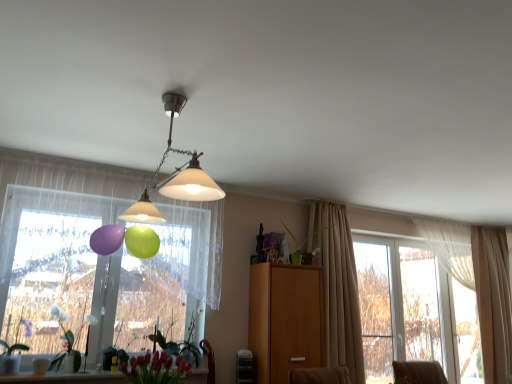
The image size is (512, 384). Describe the element at coordinates (66, 378) in the screenshot. I see `translucent glass vase at lower center, which ranks as the 2th window in top-to-bottom order` at that location.

This screenshot has height=384, width=512. What do you see at coordinates (493, 301) in the screenshot?
I see `beige fabric curtain at right, which appears as the 1th curtain when viewed from the right` at bounding box center [493, 301].

Measure the distance between beige fabric curtain at right, which is the second curtain in right-to-left order, and camera.

The depth of beige fabric curtain at right, which is the second curtain in right-to-left order, is 4.07 meters.

This screenshot has width=512, height=384. In order to click on transparent glass door at right, which is counted as the 1th window frame, starting from the right in this screenshot , I will do pyautogui.click(x=425, y=307).

What are the coordinates of `smooth glossy tulip at lower center` in the screenshot? It's located at (155, 369).

The image size is (512, 384). I want to click on translucent glass vase at lower center, which ranks as the 2th window in top-to-bottom order, so click(66, 378).

Is white matte plant at lower left, which is counted as the 2th plant, starting from the left, positioned far away from transparent glass door at right, positioned as the second window frame in left-to-right order?

white matte plant at lower left, which is counted as the 2th plant, starting from the left, is far away from transparent glass door at right, positioned as the second window frame in left-to-right order.

Can you tell me how much white matte plant at lower left, which is counted as the 2th plant, starting from the left, and transparent glass door at right, positioned as the second window frame in left-to-right order, differ in facing direction?

The angular difference between white matte plant at lower left, which is counted as the 2th plant, starting from the left, and transparent glass door at right, positioned as the second window frame in left-to-right order, is 0.00227 degrees.

Considering the sizes of white matte plant at lower left, positioned as the third plant in right-to-left order, and transparent glass door at right, positioned as the second window frame in left-to-right order, in the image, is white matte plant at lower left, positioned as the third plant in right-to-left order, bigger or smaller than transparent glass door at right, positioned as the second window frame in left-to-right order,?

Considering their sizes, white matte plant at lower left, positioned as the third plant in right-to-left order, takes up less space than transparent glass door at right, positioned as the second window frame in left-to-right order.

Could you tell me if white matte plant at lower left, positioned as the third plant in right-to-left order, is facing transparent glass door at right, which is counted as the 1th window frame, starting from the right?

No, white matte plant at lower left, positioned as the third plant in right-to-left order, does not turn towards transparent glass door at right, which is counted as the 1th window frame, starting from the right.

From a real-world perspective, between matte white lampshade at center and beige fabric curtain at right, which is the second curtain in right-to-left order, who is vertically lower?

In real-world perspective, beige fabric curtain at right, which is the second curtain in right-to-left order, is lower.

Is point (192, 154) farther from camera compared to point (346, 304)?

No, it is not.

Is matte white lampshade at center taller or shorter than beige fabric curtain at right, which is the 1th curtain in front-to-back order?

Considering their sizes, matte white lampshade at center has less height than beige fabric curtain at right, which is the 1th curtain in front-to-back order.

Between matte white lampshade at center and beige fabric curtain at right, acting as the 2th curtain starting from the back, which one is positioned in front?

matte white lampshade at center is closer to the camera.

Is wooden cabinet at center turned away from beige fabric curtain at right, which appears as the 1th curtain when viewed from the right?

wooden cabinet at center is not turned away from beige fabric curtain at right, which appears as the 1th curtain when viewed from the right.

Based on their sizes in the image, would you say wooden cabinet at center is bigger or smaller than beige fabric curtain at right, which ranks as the 1th curtain in back-to-front order?

wooden cabinet at center is bigger than beige fabric curtain at right, which ranks as the 1th curtain in back-to-front order.

From the image's perspective, is wooden cabinet at center above beige fabric curtain at right, which ranks as the 1th curtain in back-to-front order?

Yes.

Considering the relative positions of wooden cabinet at center and beige fabric curtain at right, which ranks as the 1th curtain in back-to-front order, in the image provided, is wooden cabinet at center to the right of beige fabric curtain at right, which ranks as the 1th curtain in back-to-front order, from the viewer's perspective?

Incorrect, wooden cabinet at center is not on the right side of beige fabric curtain at right, which ranks as the 1th curtain in back-to-front order.

Is translucent glass vase at lower center, which ranks as the 2th window in top-to-bottom order, not near wooden cabinet at center?

Absolutely, translucent glass vase at lower center, which ranks as the 2th window in top-to-bottom order, is distant from wooden cabinet at center.

Considering their positions, is translucent glass vase at lower center, which ranks as the 2th window in top-to-bottom order, located in front of or behind wooden cabinet at center?

translucent glass vase at lower center, which ranks as the 2th window in top-to-bottom order, is positioned closer to the viewer than wooden cabinet at center.

From a real-world perspective, who is located higher, translucent glass vase at lower center, which ranks as the 2th window in top-to-bottom order, or wooden cabinet at center?

From a 3D spatial view, wooden cabinet at center is above.

Does translucent glass vase at lower center, which ranks as the 2th window in top-to-bottom order, have a larger size compared to wooden cabinet at center?

No.

Is green matte plant at lower center, the 3th plant from the left, completely or partially inside translucent glass vase at lower center, which appears as the 1th window when ordered from the bottom?

No, green matte plant at lower center, the 3th plant from the left, is not inside translucent glass vase at lower center, which appears as the 1th window when ordered from the bottom.

Considering the sizes of objects translucent glass vase at lower center, which appears as the 1th window when ordered from the bottom, and green matte plant at lower center, the second plant from the right, in the image provided, who is taller, translucent glass vase at lower center, which appears as the 1th window when ordered from the bottom, or green matte plant at lower center, the second plant from the right,?

green matte plant at lower center, the second plant from the right.

In the image, is translucent glass vase at lower center, which appears as the 1th window when ordered from the bottom, on the left side or the right side of green matte plant at lower center, the second plant from the right?

Clearly, translucent glass vase at lower center, which appears as the 1th window when ordered from the bottom, is on the left of green matte plant at lower center, the second plant from the right, in the image.

Does translucent glass vase at lower center, which ranks as the 2th window in top-to-bottom order, have a larger size compared to green matte plant at lower center, the 3th plant from the left?

Incorrect, translucent glass vase at lower center, which ranks as the 2th window in top-to-bottom order, is not larger than green matte plant at lower center, the 3th plant from the left.

Is matte white lampshade at center wider than transparent glass door at right, which is counted as the 1th window frame, starting from the right?

Correct, the width of matte white lampshade at center exceeds that of transparent glass door at right, which is counted as the 1th window frame, starting from the right.

From a real-world perspective, is matte white lampshade at center above or below transparent glass door at right, positioned as the second window frame in left-to-right order?

In terms of real-world spatial position, matte white lampshade at center is above transparent glass door at right, positioned as the second window frame in left-to-right order.

Would you consider beige fabric curtain at right, the second curtain in the left-to-right sequence, to be distant from matte white lampshade at center?

That's right, there is a large distance between beige fabric curtain at right, the second curtain in the left-to-right sequence, and matte white lampshade at center.

Image resolution: width=512 pixels, height=384 pixels. I want to click on the 2nd curtain positioned below the matte white lampshade at center (from a real-world perspective), so click(x=493, y=301).

Is matte white lampshade at center at the back of beige fabric curtain at right, the second curtain in the left-to-right sequence?

That's not correct — beige fabric curtain at right, the second curtain in the left-to-right sequence, is not looking away from matte white lampshade at center.

How many degrees apart are the facing directions of beige fabric curtain at right, which ranks as the second curtain in front-to-back order, and matte white lampshade at center?

They differ by 89.1 degrees in their facing directions.

From a real-world perspective, starting from the transparent glass door at right, positioned as the second window frame in left-to-right order, which plant is the 2nd one below it? Please provide its 2D coordinates.

[(65, 342)]

Locate an element on the screen. The width and height of the screenshot is (512, 384). lamp above the beige fabric curtain at right, acting as the 2th curtain starting from the back (from the image's perspective) is located at coordinates pyautogui.click(x=175, y=175).

Based on their spatial positions, is green matte plant at lower left, the 4th plant positioned from the right, or green matte plant at center, acting as the first plant starting from the right, further from beige fabric curtain at right, which appears as the 1th curtain when viewed from the right?

green matte plant at lower left, the 4th plant positioned from the right, is positioned further to the anchor beige fabric curtain at right, which appears as the 1th curtain when viewed from the right.

Looking at the image, which one is located further to wooden cabinet at center, smooth glossy tulip at lower center or transparent glass window at left, marked as the second window in a bottom-to-top arrangement?

transparent glass window at left, marked as the second window in a bottom-to-top arrangement.

When comparing their distances from beige fabric curtain at right, the second curtain in the left-to-right sequence, does matte white lampshade at center or transparent glass window at left, marked as the second window in a bottom-to-top arrangement, seem further?

Among the two, matte white lampshade at center is located further to beige fabric curtain at right, the second curtain in the left-to-right sequence.

From the image, which object appears to be farther from matte white lampshade at center, green matte plant at lower left, the 4th plant positioned from the right, or transparent glass door at right, positioned as the second window frame in left-to-right order?

transparent glass door at right, positioned as the second window frame in left-to-right order, is positioned further to the anchor matte white lampshade at center.

Considering their positions, is wooden cabinet at center positioned further to green matte plant at lower left, the 4th plant positioned from the right, than transparent glass window at left, marked as the second window in a bottom-to-top arrangement?

wooden cabinet at center is further to green matte plant at lower left, the 4th plant positioned from the right.

When comparing their distances from green matte plant at center, acting as the first plant starting from the right, does clear glass window at right, arranged as the second window frame when viewed from the right, or green matte plant at lower center, the 3th plant from the left, seem further?

green matte plant at lower center, the 3th plant from the left.

When comparing their distances from clear glass window at right, which is counted as the first window frame, starting from the left, does smooth glossy tulip at lower center or beige fabric curtain at right, which is counted as the 1th curtain, starting from the left, seem closer?

beige fabric curtain at right, which is counted as the 1th curtain, starting from the left, lies closer to clear glass window at right, which is counted as the first window frame, starting from the left, than the other object.

Which object lies nearer to the anchor point translucent glass vase at lower center, which appears as the 1th window when ordered from the bottom, beige fabric curtain at right, which ranks as the second curtain in front-to-back order, or clear glass window at right, arranged as the second window frame when viewed from the right?

clear glass window at right, arranged as the second window frame when viewed from the right.

The width and height of the screenshot is (512, 384). I want to click on window frame between beige fabric curtain at right, which is counted as the 1th curtain, starting from the left, and transparent glass door at right, which is counted as the 1th window frame, starting from the right, so click(x=375, y=309).

You are a GUI agent. You are given a task and a screenshot of the screen. Output one action in this format:
    pyautogui.click(x=<x>, y=<y>)
    Task: Click on the furniture between green matte plant at lower left, the 4th plant positioned from the right, and beige fabric curtain at right, which ranks as the 1th curtain in back-to-front order, in the horizontal direction
    The height and width of the screenshot is (384, 512).
    Given the screenshot: What is the action you would take?
    pyautogui.click(x=285, y=320)

The height and width of the screenshot is (384, 512). In order to click on window between transparent glass window at left, marked as the second window in a bottom-to-top arrangement, and transparent glass door at right, positioned as the second window frame in left-to-right order, from left to right in this screenshot , I will do `click(66, 378)`.

Image resolution: width=512 pixels, height=384 pixels. What are the coordinates of `flower situated between transparent glass window at left, marked as the second window in a bottom-to-top arrangement, and transparent glass door at right, which is counted as the 1th window frame, starting from the right, from left to right` in the screenshot? It's located at (155, 369).